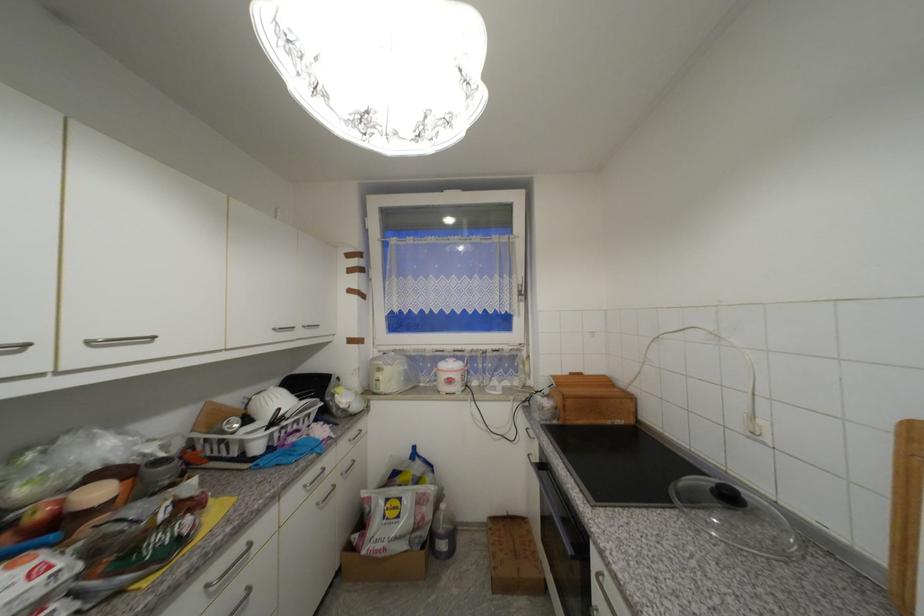
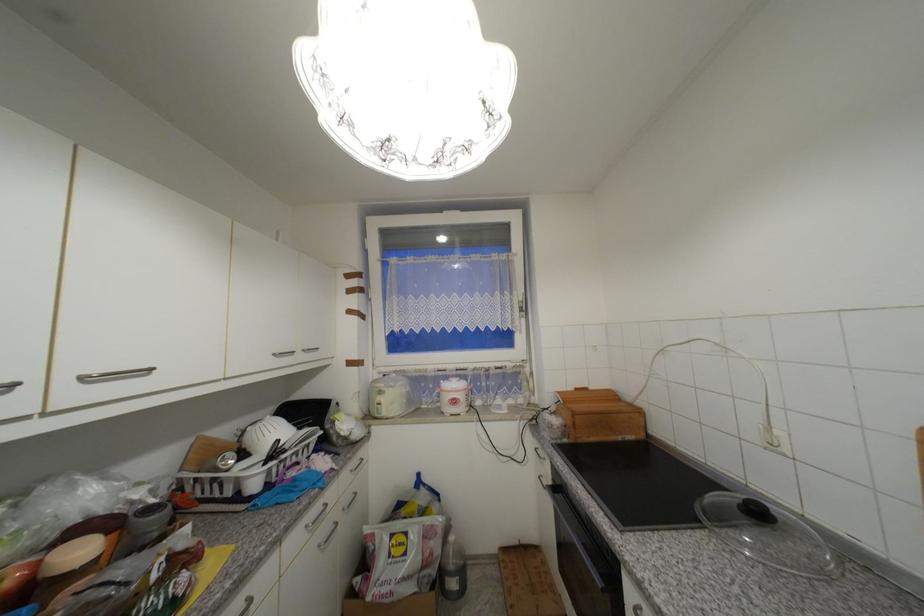
Locate, in the second image, the point that corresponds to point (327, 492) in the first image.

(330, 531)